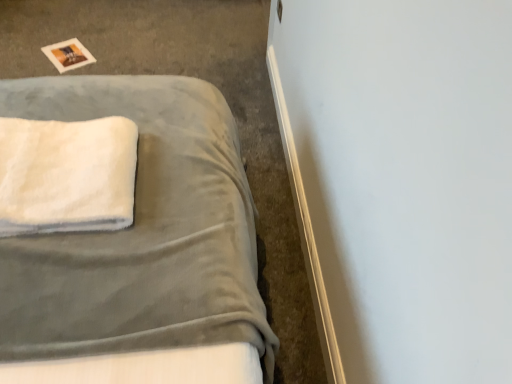
At what (x,y) coordinates should I click in order to perform the action: click on empty space that is ontop of white fluffy towel at upper left (from a real-world perspective). Please return your answer as a coordinate pair (x, y). The height and width of the screenshot is (384, 512). Looking at the image, I should click on (56, 153).